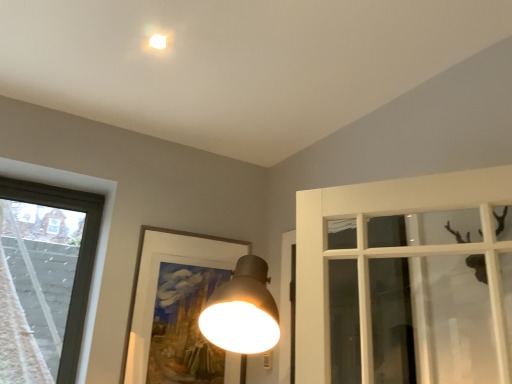
This screenshot has width=512, height=384. What do you see at coordinates (176, 302) in the screenshot? I see `matte gold picture frame at center` at bounding box center [176, 302].

You are a GUI agent. You are given a task and a screenshot of the screen. Output one action in this format:
    pyautogui.click(x=<x>, y=<y>)
    Task: Click on the matte gold picture frame at center
    The width and height of the screenshot is (512, 384).
    Given the screenshot: What is the action you would take?
    pyautogui.click(x=176, y=302)

Measure the distance between matte gold picture frame at center and camera.

matte gold picture frame at center is 6.32 feet from camera.

Where is `matte gold picture frame at center`? This screenshot has height=384, width=512. matte gold picture frame at center is located at coordinates (176, 302).